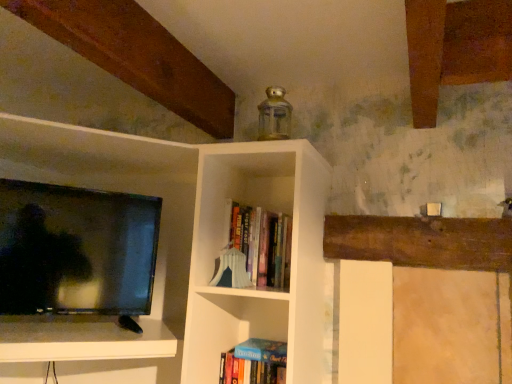
Where is `hardcover book at lower center, which ranks as the 2th book in top-to-bottom order`? hardcover book at lower center, which ranks as the 2th book in top-to-bottom order is located at coordinates (254, 363).

How much space does hardcover book at lower center, which ranks as the 2th book in top-to-bottom order, occupy horizontally?

hardcover book at lower center, which ranks as the 2th book in top-to-bottom order, is 6.82 inches wide.

What do you see at coordinates (254, 363) in the screenshot? I see `hardcover book at lower center, which ranks as the 2th book in top-to-bottom order` at bounding box center [254, 363].

This screenshot has height=384, width=512. What do you see at coordinates (262, 244) in the screenshot?
I see `hardcover books at center, which is the first book from top to bottom` at bounding box center [262, 244].

At what (x,y) coordinates should I click in order to perform the action: click on hardcover books at center, which is the first book from top to bottom. Please return your answer as a coordinate pair (x, y). Image resolution: width=512 pixels, height=384 pixels. Looking at the image, I should click on (262, 244).

What is the approximate height of hardcover books at center, which is the first book from top to bottom?

hardcover books at center, which is the first book from top to bottom, is 11.90 inches in height.

Locate an element on the screen. The width and height of the screenshot is (512, 384). hardcover book at lower center, arranged as the 1th book when ordered from the bottom is located at coordinates (254, 363).

Which is more to the right, hardcover books at center, which is the first book from top to bottom, or hardcover book at lower center, which ranks as the 2th book in top-to-bottom order?

Positioned to the right is hardcover books at center, which is the first book from top to bottom.

Which object is further away from the camera, hardcover books at center, the 2th book when ordered from bottom to top, or hardcover book at lower center, which ranks as the 2th book in top-to-bottom order?

Positioned behind is hardcover book at lower center, which ranks as the 2th book in top-to-bottom order.

Does point (255, 247) appear closer or farther from the camera than point (270, 343)?

Point (255, 247) is positioned closer to the camera compared to point (270, 343).

From the image's perspective, which one is positioned higher, hardcover books at center, which is the first book from top to bottom, or hardcover book at lower center, arranged as the 1th book when ordered from the bottom?

hardcover books at center, which is the first book from top to bottom, appears higher in the image.

From a real-world perspective, which is physically above, hardcover books at center, the 2th book when ordered from bottom to top, or hardcover book at lower center, which ranks as the 2th book in top-to-bottom order?

hardcover books at center, the 2th book when ordered from bottom to top, is physically above.

Can you confirm if hardcover books at center, which is the first book from top to bottom, is thinner than hardcover book at lower center, arranged as the 1th book when ordered from the bottom?

Indeed, hardcover books at center, which is the first book from top to bottom, has a lesser width compared to hardcover book at lower center, arranged as the 1th book when ordered from the bottom.

Which of these two, hardcover books at center, the 2th book when ordered from bottom to top, or hardcover book at lower center, arranged as the 1th book when ordered from the bottom, stands taller?

hardcover books at center, the 2th book when ordered from bottom to top.

Does hardcover books at center, the 2th book when ordered from bottom to top, have a larger size compared to hardcover book at lower center, which ranks as the 2th book in top-to-bottom order?

Indeed, hardcover books at center, the 2th book when ordered from bottom to top, has a larger size compared to hardcover book at lower center, which ranks as the 2th book in top-to-bottom order.

Would you say hardcover book at lower center, which ranks as the 2th book in top-to-bottom order, is part of hardcover books at center, which is the first book from top to bottom,'s contents?

No, hardcover book at lower center, which ranks as the 2th book in top-to-bottom order, is located outside of hardcover books at center, which is the first book from top to bottom.

Does hardcover books at center, which is the first book from top to bottom, touch hardcover book at lower center, arranged as the 1th book when ordered from the bottom?

No, hardcover books at center, which is the first book from top to bottom, is not making contact with hardcover book at lower center, arranged as the 1th book when ordered from the bottom.

Is hardcover books at center, the 2th book when ordered from bottom to top, turned away from hardcover book at lower center, arranged as the 1th book when ordered from the bottom?

No, hardcover books at center, the 2th book when ordered from bottom to top,'s orientation is not away from hardcover book at lower center, arranged as the 1th book when ordered from the bottom.

This screenshot has width=512, height=384. I want to click on book in front of the hardcover book at lower center, which ranks as the 2th book in top-to-bottom order, so click(x=262, y=244).

Can you confirm if hardcover book at lower center, which ranks as the 2th book in top-to-bottom order, is positioned to the left of hardcover books at center, the 2th book when ordered from bottom to top?

Correct, you'll find hardcover book at lower center, which ranks as the 2th book in top-to-bottom order, to the left of hardcover books at center, the 2th book when ordered from bottom to top.

Does hardcover book at lower center, arranged as the 1th book when ordered from the bottom, come in front of hardcover books at center, the 2th book when ordered from bottom to top?

No, it is not.

Considering the points (267, 377) and (286, 240), which point is in front, point (267, 377) or point (286, 240)?

The point (286, 240) is more forward.

From the image's perspective, would you say hardcover book at lower center, which ranks as the 2th book in top-to-bottom order, is shown under hardcover books at center, the 2th book when ordered from bottom to top?

Correct, hardcover book at lower center, which ranks as the 2th book in top-to-bottom order, appears lower than hardcover books at center, the 2th book when ordered from bottom to top, in the image.

From a real-world perspective, is hardcover book at lower center, which ranks as the 2th book in top-to-bottom order, located beneath hardcover books at center, the 2th book when ordered from bottom to top?

Yes, from a real-world perspective, hardcover book at lower center, which ranks as the 2th book in top-to-bottom order, is beneath hardcover books at center, the 2th book when ordered from bottom to top.

Between hardcover book at lower center, which ranks as the 2th book in top-to-bottom order, and hardcover books at center, the 2th book when ordered from bottom to top, which one has smaller width?

Result: With smaller width is hardcover books at center, the 2th book when ordered from bottom to top.

Who is shorter, hardcover book at lower center, arranged as the 1th book when ordered from the bottom, or hardcover books at center, which is the first book from top to bottom?

With less height is hardcover book at lower center, arranged as the 1th book when ordered from the bottom.

Looking at the image, does hardcover book at lower center, which ranks as the 2th book in top-to-bottom order, seem bigger or smaller compared to hardcover books at center, the 2th book when ordered from bottom to top?

Clearly, hardcover book at lower center, which ranks as the 2th book in top-to-bottom order, is smaller in size than hardcover books at center, the 2th book when ordered from bottom to top.

Is hardcover books at center, the 2th book when ordered from bottom to top, located within hardcover book at lower center, arranged as the 1th book when ordered from the bottom?

That's incorrect, hardcover books at center, the 2th book when ordered from bottom to top, is not inside hardcover book at lower center, arranged as the 1th book when ordered from the bottom.

Is hardcover book at lower center, which ranks as the 2th book in top-to-bottom order, far away from hardcover books at center, which is the first book from top to bottom?

Actually, hardcover book at lower center, which ranks as the 2th book in top-to-bottom order, and hardcover books at center, which is the first book from top to bottom, are a little close together.

From the picture: Could you tell me if hardcover book at lower center, arranged as the 1th book when ordered from the bottom, is turned towards hardcover books at center, which is the first book from top to bottom?

No.

Consider the image. How different are the orientations of hardcover book at lower center, which ranks as the 2th book in top-to-bottom order, and hardcover books at center, which is the first book from top to bottom, in degrees?

2.22 degrees separate the facing orientations of hardcover book at lower center, which ranks as the 2th book in top-to-bottom order, and hardcover books at center, which is the first book from top to bottom.

I want to click on book that is above the hardcover book at lower center, which ranks as the 2th book in top-to-bottom order (from a real-world perspective), so click(x=262, y=244).

Locate an element on the screen. book above the hardcover book at lower center, which ranks as the 2th book in top-to-bottom order (from the image's perspective) is located at coordinates (262, 244).

Find the location of a particular element. The width and height of the screenshot is (512, 384). book that appears below the hardcover books at center, which is the first book from top to bottom (from the image's perspective) is located at coordinates pos(254,363).